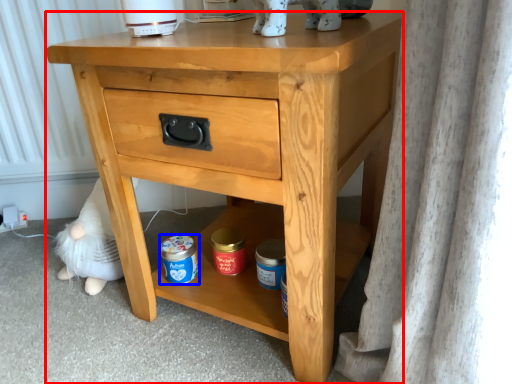
Question: Which object is closer to the camera taking this photo, nightstand (highlighted by a red box) or glass jar (highlighted by a blue box)?

Choices:
 (A) nightstand
 (B) glass jar

Answer: (A)